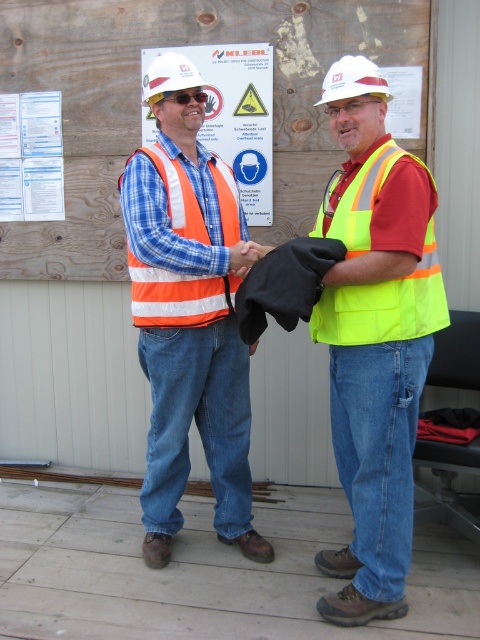
Is point (396, 104) positioned before point (357, 72)?

No.

Which is below, white paper at upper center or white hard hat at center?

Positioned lower is white hard hat at center.

I want to click on white paper at upper center, so click(404, 100).

Find the location of `white paper at upper center`. white paper at upper center is located at coordinates (404, 100).

Does wooden signboard at center appear under orange reflective vest at center?

Actually, wooden signboard at center is above orange reflective vest at center.

Which is more to the right, wooden signboard at center or orange reflective vest at center?

orange reflective vest at center

Where is `wooden signboard at center`? This screenshot has width=480, height=640. wooden signboard at center is located at coordinates 140,106.

Image resolution: width=480 pixels, height=640 pixels. I want to click on wooden signboard at center, so click(140, 106).

Measure the distance from orange reflective safety vest at center to white paper at upper left.

1.08 meters

Between orange reflective safety vest at center and white paper at upper left, which one is positioned higher?

white paper at upper left is higher up.

This screenshot has width=480, height=640. Identify the location of orange reflective safety vest at center. (178, 296).